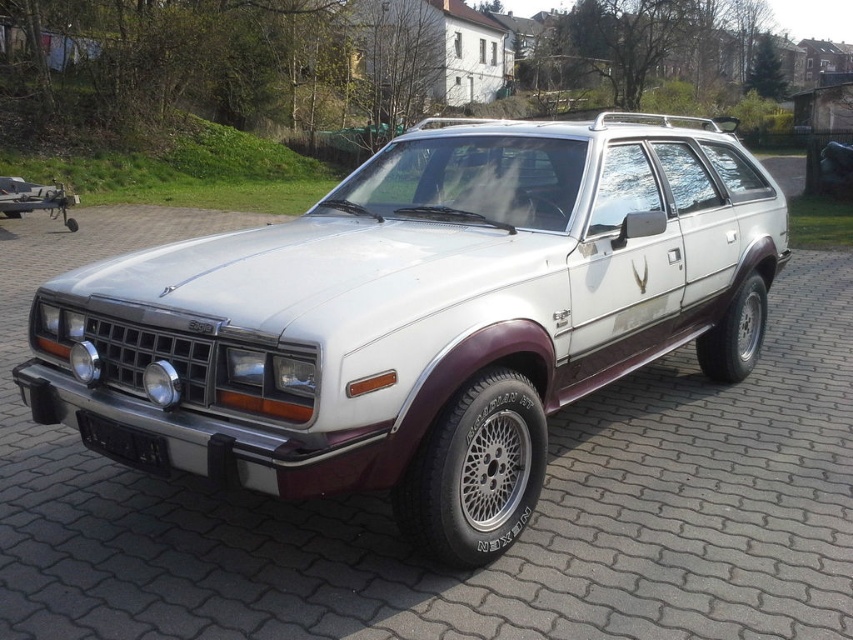
You are standing in front of the white matte station wagon at center and the gray concrete driveway at center. Which object is nearer to you?

The white matte station wagon at center is closer to the viewer than the gray concrete driveway at center.

You are a delivery person trying to park a white matte station wagon at center in a tight space. You need to ensure that the car will not hit the black plastic license plate at lower center when backing up. Based on the size comparison between them, can you estimate if there will be enough space?

The white matte station wagon at center is larger in size than the black plastic license plate at lower center. Since the license plate is smaller, there should be enough space between them when backing up, provided the alignment is correct.